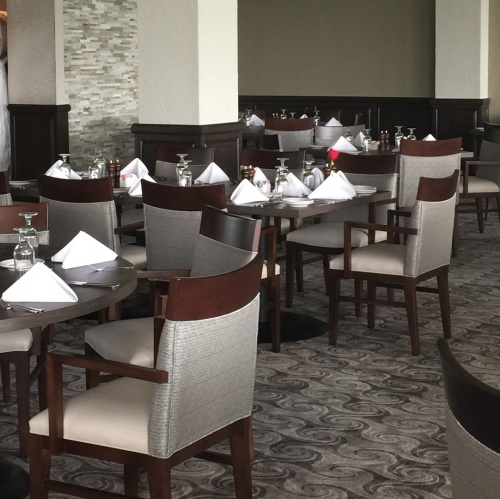
The height and width of the screenshot is (499, 500). I want to click on tables, so click(x=23, y=292), click(x=284, y=205), click(x=387, y=148), click(x=296, y=113).